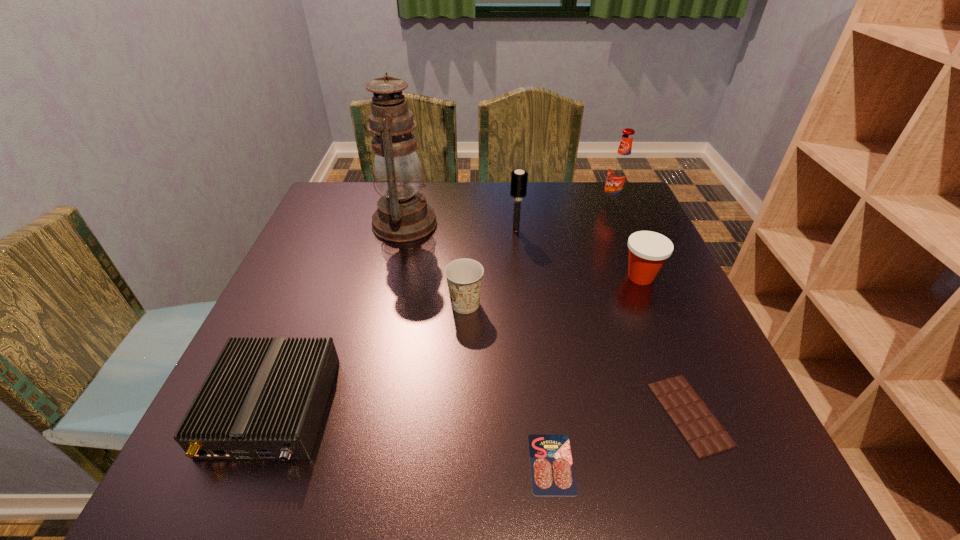
You are a GUI agent. You are given a task and a screenshot of the screen. Output one action in this format:
    pyautogui.click(x=<x>, y=<y>)
    Task: Click on the router that is at the near edge
    
    Given the screenshot: What is the action you would take?
    pyautogui.click(x=263, y=398)

You are a GUI agent. You are given a task and a screenshot of the screen. Output one action in this format:
    pyautogui.click(x=<x>, y=<y>)
    Task: Click on the chocolate bar positioned at the near edge
    The height and width of the screenshot is (540, 960).
    Given the screenshot: What is the action you would take?
    pyautogui.click(x=702, y=431)

The image size is (960, 540). I want to click on salami located in the near edge section of the desktop, so click(552, 473).

Where is `oil lamp that is positioned at the left edge`? This screenshot has width=960, height=540. oil lamp that is positioned at the left edge is located at coordinates (403, 215).

I want to click on router that is at the left edge, so click(x=263, y=398).

In order to click on root beer that is at the right edge in this screenshot , I will do `click(619, 173)`.

Identify the location of Dixie cup located at the right edge. (648, 250).

Locate an element on the screen. chocolate bar present at the right edge is located at coordinates (702, 431).

In order to click on object that is at the far left corner in this screenshot , I will do `click(403, 215)`.

At what (x,y) coordinates should I click in order to perform the action: click on object at the near left corner. Please return your answer as a coordinate pair (x, y). Looking at the image, I should click on (263, 398).